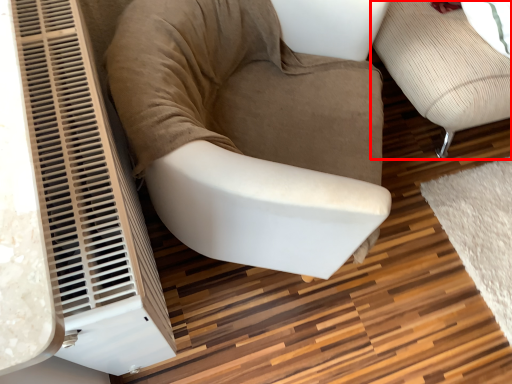
Question: From the image's perspective, what is the correct spatial positioning of furniture (annotated by the red box) in reference to chair?

Choices:
 (A) above
 (B) below

Answer: (A)